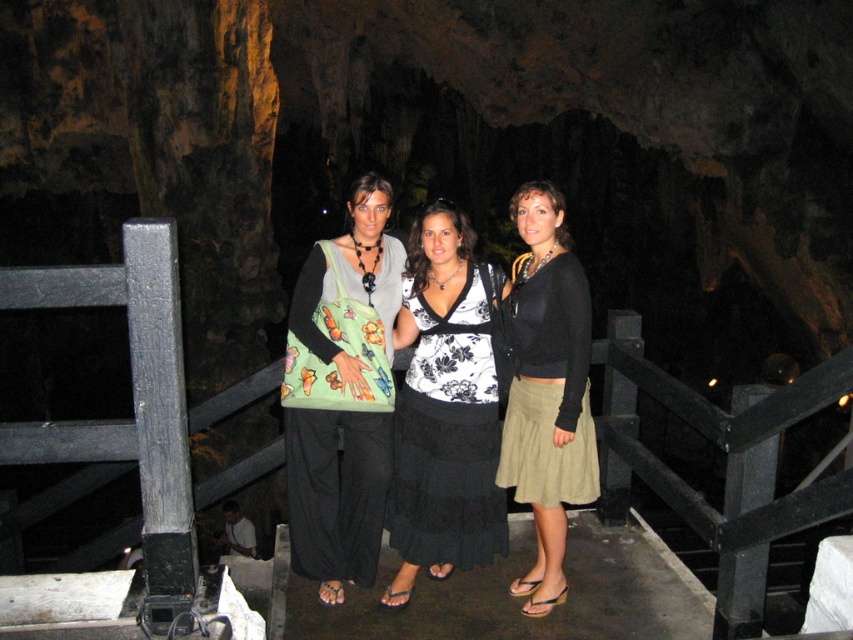
You are standing at the origin point in the cave. You need to move towards the point labeled point (x=291, y=536). Will you pass by point (x=518, y=353) first?

Yes, because point (x=291, y=536) is behind point (x=518, y=353), so you will pass by point (x=518, y=353) first when moving towards the target point.

You are a photographer setting up a shot in a cave. You notice a green fabric bag at center and a black floral dress at center. Which object is covering part of the other?

The green fabric bag at center is positioned over the black floral dress at center, so it is covering part of it.